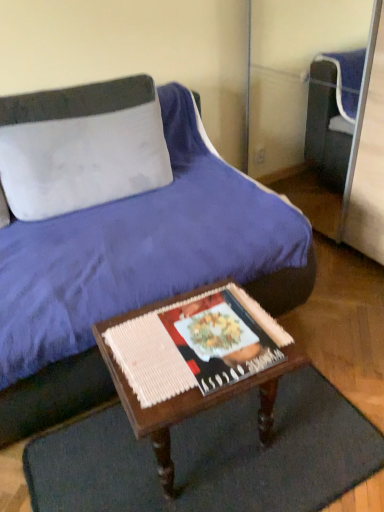
Question: Considering the relative positions of velvet blue bed at center and matte paper magazine at center in the image provided, is velvet blue bed at center to the right of matte paper magazine at center from the viewer's perspective?

Choices:
 (A) yes
 (B) no

Answer: (B)

Question: Is velvet blue bed at center next to matte paper magazine at center?

Choices:
 (A) yes
 (B) no

Answer: (B)

Question: Could matte paper magazine at center be considered to be inside velvet blue bed at center?

Choices:
 (A) no
 (B) yes

Answer: (A)

Question: Considering the relative sizes of velvet blue bed at center and matte paper magazine at center in the image provided, is velvet blue bed at center thinner than matte paper magazine at center?

Choices:
 (A) yes
 (B) no

Answer: (B)

Question: From a real-world perspective, is velvet blue bed at center positioned over matte paper magazine at center based on gravity?

Choices:
 (A) no
 (B) yes

Answer: (B)

Question: Is velvet blue bed at center closer to the viewer compared to matte paper magazine at center?

Choices:
 (A) yes
 (B) no

Answer: (A)

Question: Does white fabric pillow at upper left have a lesser height compared to velvet blue bed at center?

Choices:
 (A) no
 (B) yes

Answer: (B)

Question: Would you consider white fabric pillow at upper left to be distant from velvet blue bed at center?

Choices:
 (A) no
 (B) yes

Answer: (A)

Question: Is white fabric pillow at upper left behind velvet blue bed at center?

Choices:
 (A) yes
 (B) no

Answer: (A)

Question: From the image's perspective, is white fabric pillow at upper left beneath velvet blue bed at center?

Choices:
 (A) yes
 (B) no

Answer: (B)

Question: Could you tell me if white fabric pillow at upper left is turned towards velvet blue bed at center?

Choices:
 (A) yes
 (B) no

Answer: (A)

Question: Is white fabric pillow at upper left thinner than velvet blue bed at center?

Choices:
 (A) no
 (B) yes

Answer: (B)

Question: Is white fabric pillow at upper left positioned before dark brown woven mat at lower center?

Choices:
 (A) no
 (B) yes

Answer: (A)